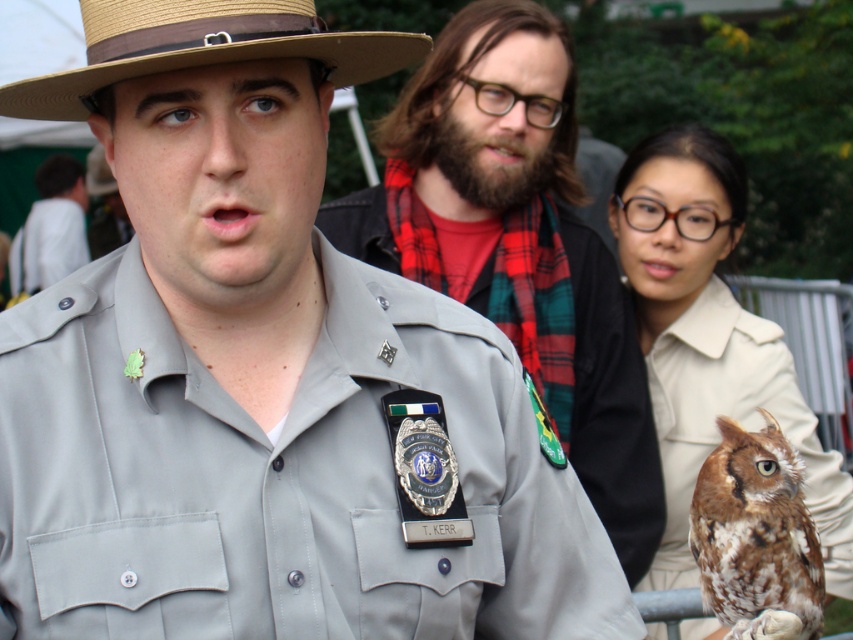
You are a visitor at the park and see the gray uniform at center and the natural straw hat at upper left. Which object is closer to you?

The gray uniform at center is closer to you because the natural straw hat at upper left is behind it.